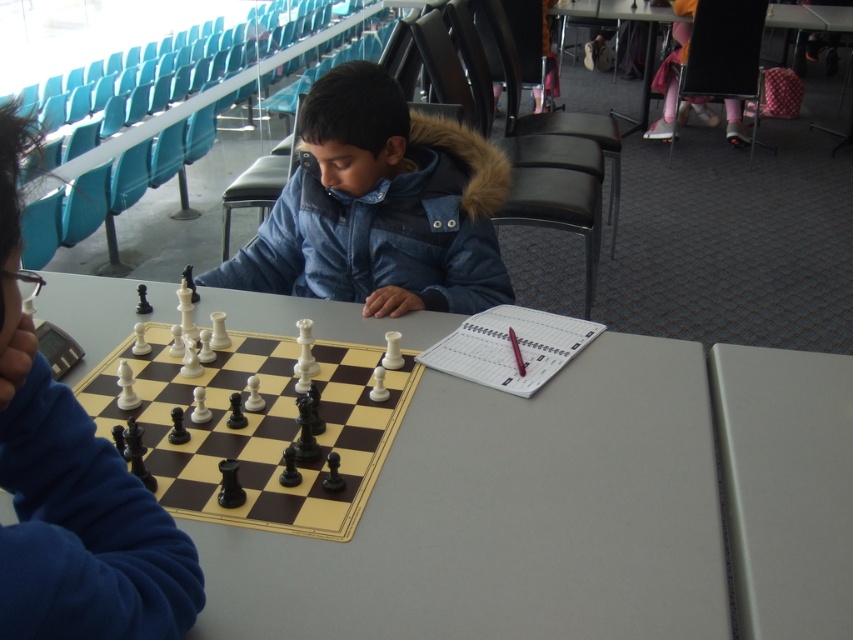
Question: Among these objects, which one is farthest from the camera?

Choices:
 (A) smooth plastic table at center
 (B) white plastic chessboard at center
 (C) denim jacket at center
 (D) white matte table at center

Answer: (C)

Question: Which point is farther to the camera?

Choices:
 (A) (189, 474)
 (B) (370, 163)
 (C) (727, 381)
 (D) (569, 616)

Answer: (B)

Question: Considering the real-world distances, which object is closest to the white matte table at center?

Choices:
 (A) smooth plastic table at center
 (B) denim jacket at center

Answer: (A)

Question: Can you confirm if denim jacket at center is positioned to the left of white matte table at center?

Choices:
 (A) yes
 (B) no

Answer: (A)

Question: Considering the relative positions of smooth plastic table at center and white matte table at center in the image provided, where is smooth plastic table at center located with respect to white matte table at center?

Choices:
 (A) below
 (B) above

Answer: (B)

Question: Is smooth plastic table at center to the left of denim jacket at center from the viewer's perspective?

Choices:
 (A) yes
 (B) no

Answer: (A)